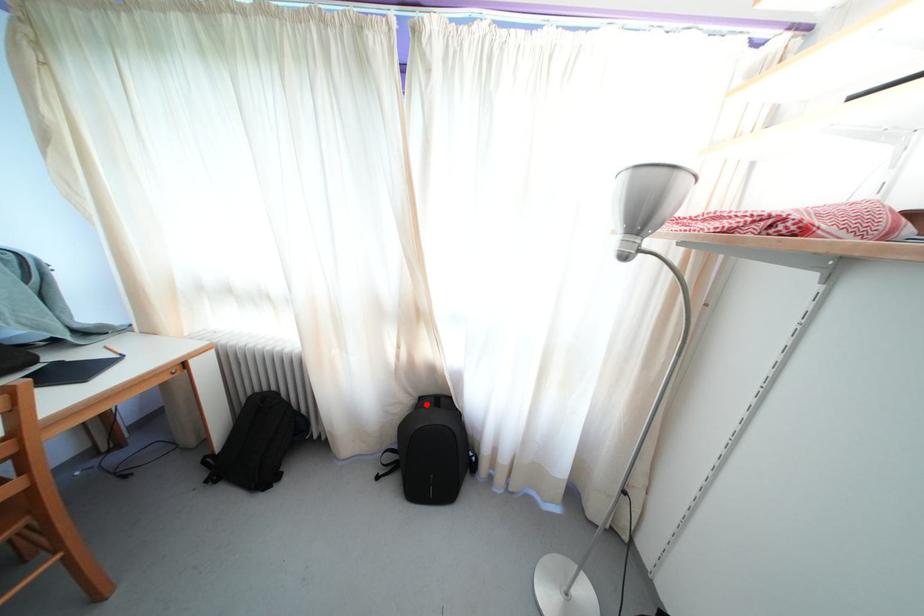
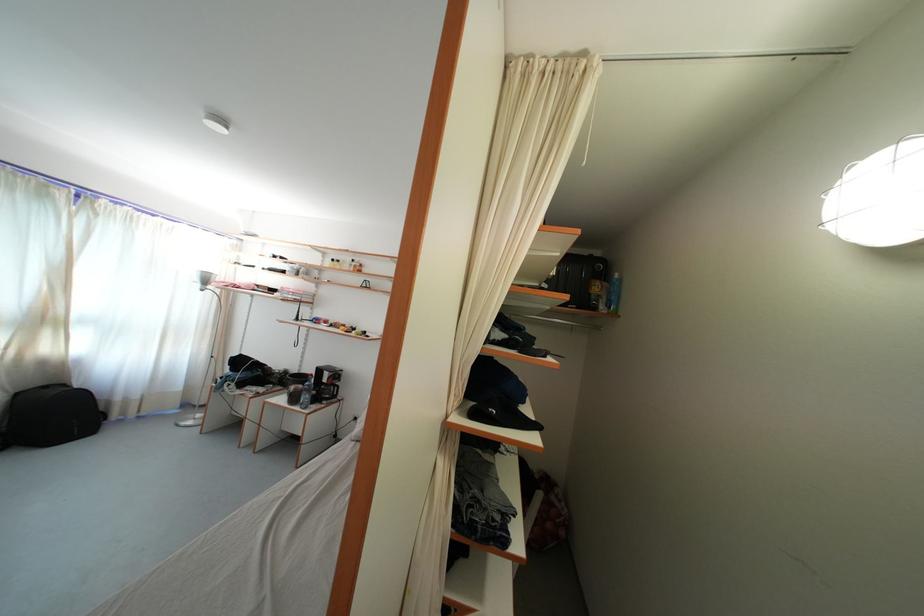
The point at the highlighted location is marked in the first image. Where is the corresponding point in the second image?

(23, 400)